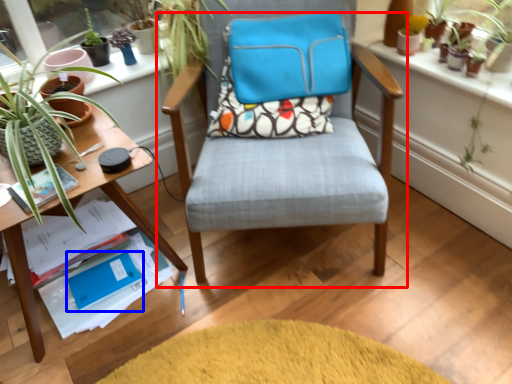
Question: Among these objects, which one is farthest to the camera, chair (highlighted by a red box) or paperback book (highlighted by a blue box)?

Choices:
 (A) chair
 (B) paperback book

Answer: (B)